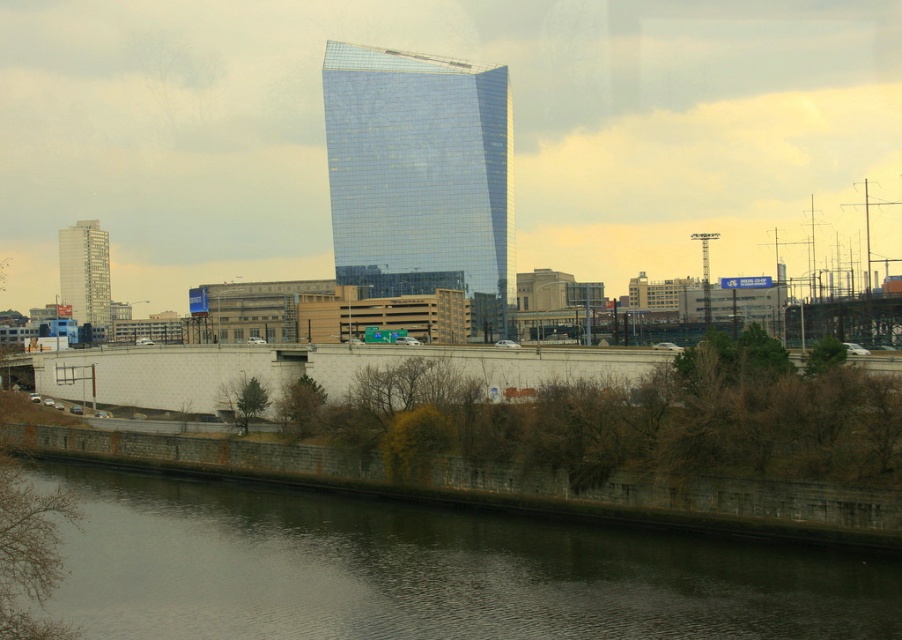
Which is above, dark gray concrete wall at lower center or matte gray building at left?

Positioned higher is matte gray building at left.

Is dark gray concrete wall at lower center thinner than matte gray building at left?

Incorrect, dark gray concrete wall at lower center's width is not less than matte gray building at left's.

Does point (882, 625) come in front of point (91, 236)?

Yes, point (882, 625) is closer to viewer.

This screenshot has width=902, height=640. What are the coordinates of `dark gray concrete wall at lower center` in the screenshot? It's located at (428, 572).

Does point (558, 577) come closer to viewer compared to point (488, 230)?

Yes, point (558, 577) is in front of point (488, 230).

Can you confirm if dark gray concrete wall at lower center is smaller than glossy glass skyscraper at center?

Yes, dark gray concrete wall at lower center is smaller than glossy glass skyscraper at center.

Who is more distant from viewer, (332, 593) or (434, 104)?

Point (434, 104)

At what (x,y) coordinates should I click in order to perform the action: click on dark gray concrete wall at lower center. Please return your answer as a coordinate pair (x, y). This screenshot has width=902, height=640. Looking at the image, I should click on (428, 572).

In the scene shown: Does glossy glass skyscraper at center lie behind matte gray building at left?

Yes, it is.

Measure the distance between point (466, 198) and camera.

They are 349.03 meters apart.

Find the location of a particular element. glossy glass skyscraper at center is located at coordinates (419, 177).